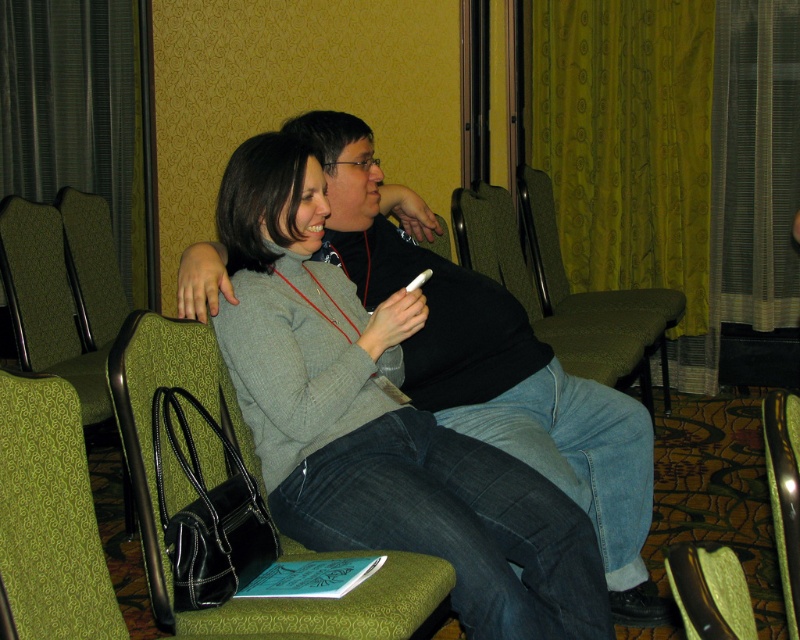
You are a photographer setting up for a group photo in the conference room. You need to position a light source between the matte gray sweater at center and the brown leather armchair at lower right. Based on their positions, which object should the light be placed closer to?

The brown leather armchair at lower right is behind the matte gray sweater at center, so the light should be placed closer to the matte gray sweater at center to ensure proper illumination without casting shadows from the armchair.

You are organizing a meeting and need to seat two people. You have a green fabric armchair at center and a brown leather armchair at lower right. Which chair is closer to the left side of the room?

The green fabric armchair at center is positioned on the left side of brown leather armchair at lower right, so it is closer to the left side of the room.